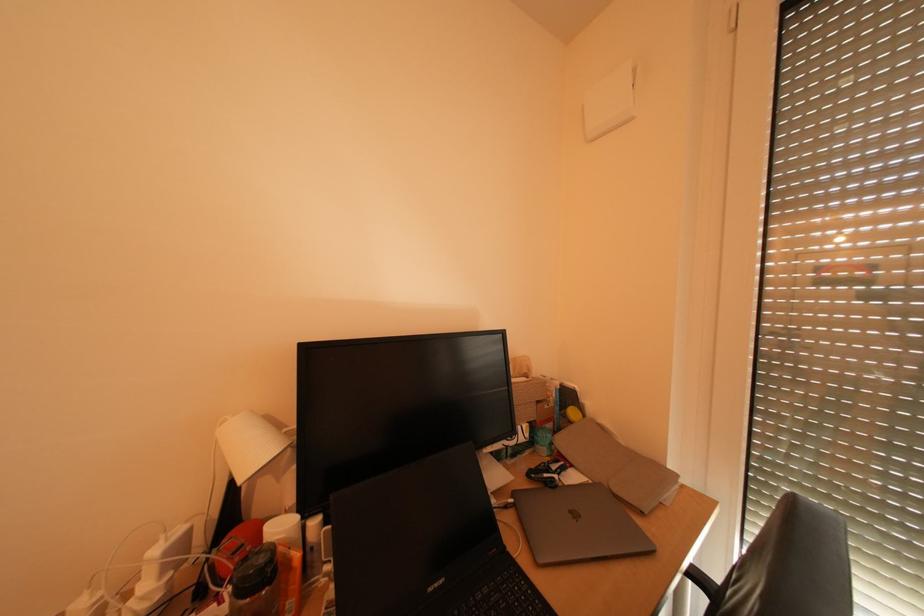
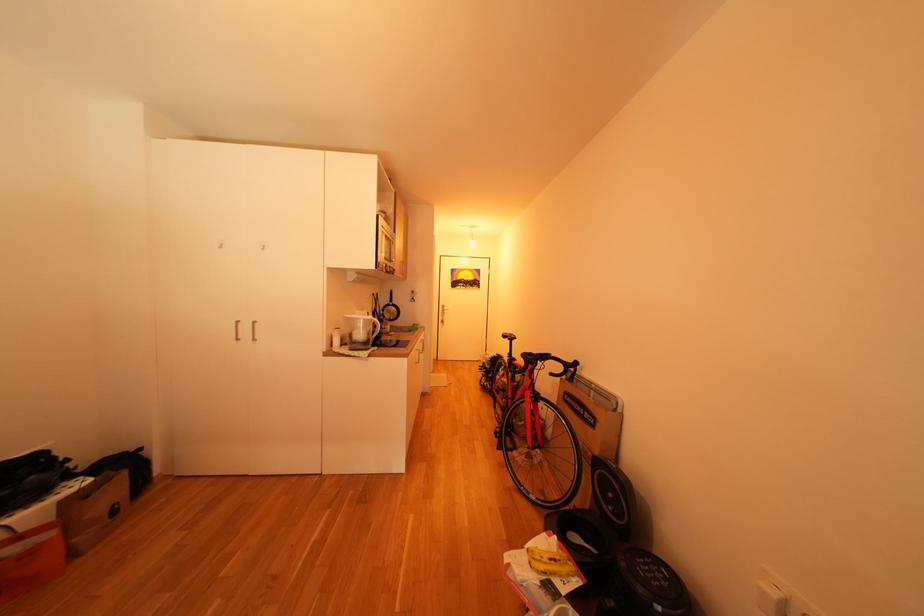
Question: Based on the continuous images, in which direction is the camera rotating? Reply with the corresponding letter.

Choices:
 (A) Left
 (B) Right
 (C) Up
 (D) Down

Answer: (A)